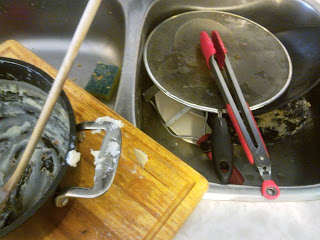
Locate an element on the screen. The image size is (320, 240). cooking pot is located at coordinates (42, 214).